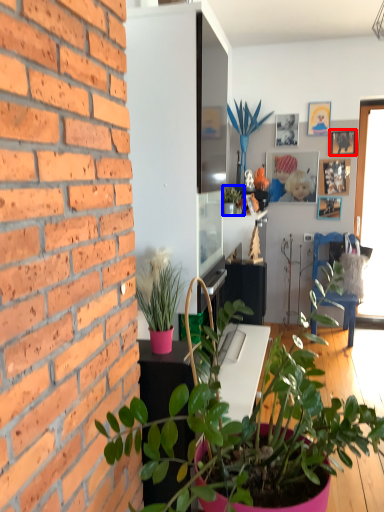
Question: Which object is further to the camera taking this photo, picture frame (highlighted by a red box) or houseplant (highlighted by a blue box)?

Choices:
 (A) picture frame
 (B) houseplant

Answer: (A)